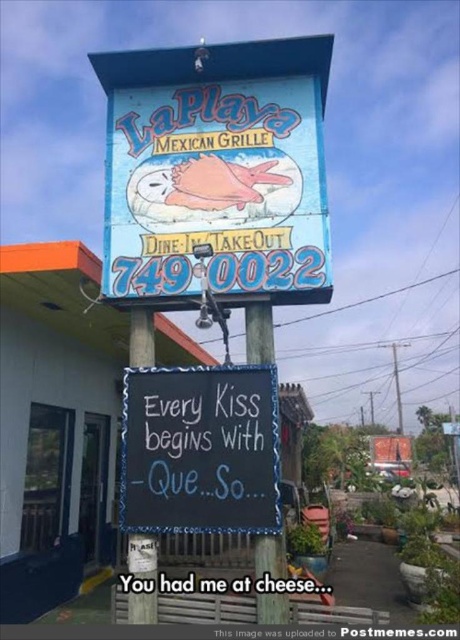
Question: Which point is farther to the camera?

Choices:
 (A) (269, 358)
 (B) (138, 557)

Answer: (A)

Question: Which object appears farthest from the camera in this image?

Choices:
 (A) wooden signpost at center
 (B) blue wooden signpost at center
 (C) black chalkboard at center

Answer: (A)

Question: Is black chalkboard at center to the left of wooden signpost at center from the viewer's perspective?

Choices:
 (A) yes
 (B) no

Answer: (B)

Question: Is black chalkboard at center thinner than blue wooden signpost at center?

Choices:
 (A) no
 (B) yes

Answer: (A)

Question: Which object is the farthest from the black chalkboard at center?

Choices:
 (A) wooden signpost at center
 (B) blue wooden signpost at center

Answer: (B)

Question: Can you confirm if black chalkboard at center is wider than blue wooden signpost at center?

Choices:
 (A) yes
 (B) no

Answer: (A)